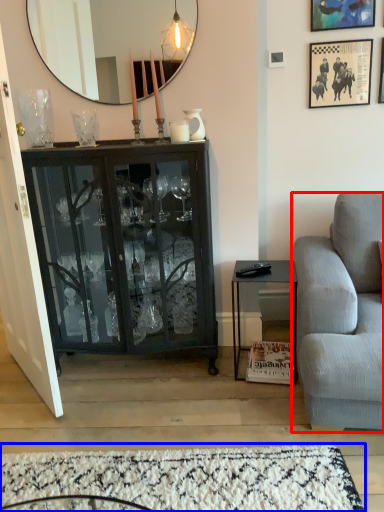
Question: Which point is further to the camera, studio couch (highlighted by a red box) or plain (highlighted by a blue box)?

Choices:
 (A) studio couch
 (B) plain

Answer: (B)